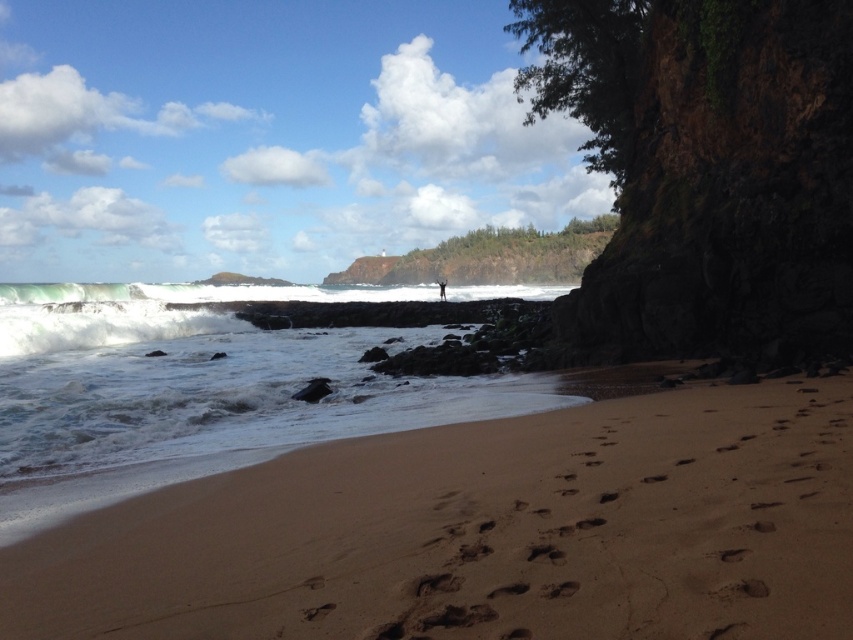
Question: Which point is farther to the camera?

Choices:
 (A) brown textured person at center
 (B) brown rough rock at right

Answer: (A)

Question: Does sandy beach at lower left appear under white frothy water at lower left?

Choices:
 (A) no
 (B) yes

Answer: (B)

Question: Estimate the real-world distances between objects in this image. Which object is closer to the brown textured person at center?

Choices:
 (A) white frothy water at lower left
 (B) brown rough rock at right
 (C) sandy beach at lower left

Answer: (A)

Question: Does sandy beach at lower left have a lesser width compared to brown textured person at center?

Choices:
 (A) no
 (B) yes

Answer: (B)

Question: Considering the real-world distances, which object is farthest from the brown rough rock at right?

Choices:
 (A) white frothy water at lower left
 (B) brown textured person at center
 (C) sandy beach at lower left

Answer: (B)

Question: Is sandy beach at lower left smaller than brown rough rock at right?

Choices:
 (A) yes
 (B) no

Answer: (A)